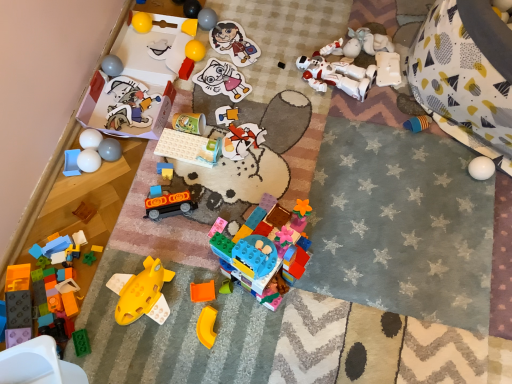
Identify the location of free area in between matte paper sticker at center, the eighteenth toy positioned from the left, and translucent orange plastic at center, the fifth toy in the right-to-left sequence. (224, 159).